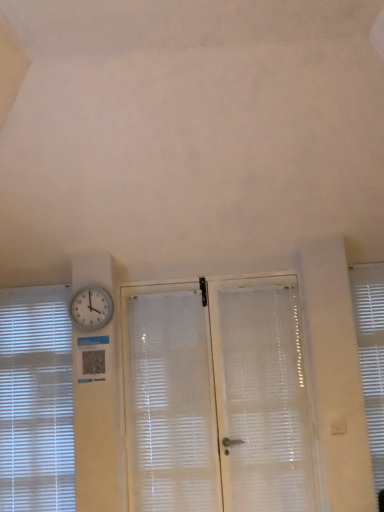
Question: Is white frosted glass screen door at center not close to white translucent shutter at center?

Choices:
 (A) yes
 (B) no

Answer: (B)

Question: From a real-world perspective, does white frosted glass screen door at center stand above white translucent shutter at center?

Choices:
 (A) no
 (B) yes

Answer: (B)

Question: From the image's perspective, does white frosted glass screen door at center appear lower than white translucent shutter at center?

Choices:
 (A) yes
 (B) no

Answer: (B)

Question: Considering the relative sizes of white frosted glass screen door at center and white translucent shutter at center in the image provided, is white frosted glass screen door at center wider than white translucent shutter at center?

Choices:
 (A) yes
 (B) no

Answer: (B)

Question: Considering the relative positions of white frosted glass screen door at center and white translucent shutter at center in the image provided, is white frosted glass screen door at center to the right of white translucent shutter at center from the viewer's perspective?

Choices:
 (A) no
 (B) yes

Answer: (B)

Question: Does point (137, 398) appear closer or farther from the camera than point (52, 312)?

Choices:
 (A) closer
 (B) farther

Answer: (A)

Question: Considering the positions of white frosted glass screen door at center and white translucent blinds at left, the 1th window blind viewed from the left, in the image, is white frosted glass screen door at center wider or thinner than white translucent blinds at left, the 1th window blind viewed from the left,?

Choices:
 (A) thin
 (B) wide

Answer: (A)

Question: Based on their positions, is white frosted glass screen door at center located to the left or right of white translucent blinds at left, the 1th window blind viewed from the left?

Choices:
 (A) right
 (B) left

Answer: (A)

Question: Looking at the image, does white frosted glass screen door at center seem bigger or smaller compared to white translucent blinds at left, the 1th window blind viewed from the left?

Choices:
 (A) big
 (B) small

Answer: (A)

Question: In terms of width, does white textured window blind at right, the second window blind positioned from the left, look wider or thinner when compared to white frosted glass screen door at center?

Choices:
 (A) thin
 (B) wide

Answer: (B)

Question: From the image's perspective, is white textured window blind at right, the second window blind positioned from the left, positioned above or below white frosted glass screen door at center?

Choices:
 (A) above
 (B) below

Answer: (A)

Question: Choose the correct answer: Is white textured window blind at right, the second window blind positioned from the left, inside white frosted glass screen door at center or outside it?

Choices:
 (A) inside
 (B) outside

Answer: (B)

Question: Considering the positions of point (379, 416) and point (173, 473), is point (379, 416) closer or farther from the camera than point (173, 473)?

Choices:
 (A) farther
 (B) closer

Answer: (B)

Question: In the image, is white translucent shutter at center on the left side or the right side of white frosted glass screen door at center?

Choices:
 (A) left
 (B) right

Answer: (A)

Question: Is white translucent shutter at center taller or shorter than white frosted glass screen door at center?

Choices:
 (A) short
 (B) tall

Answer: (A)